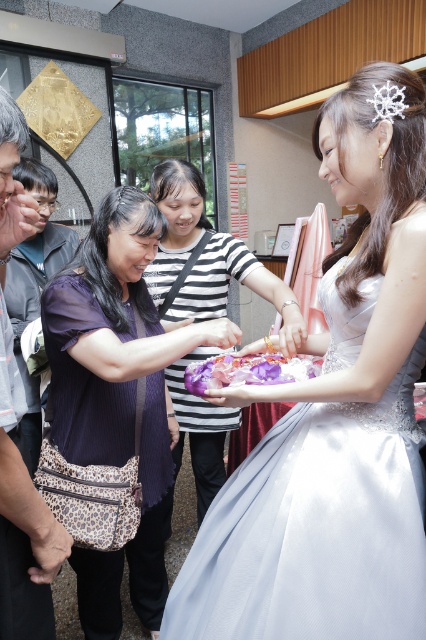
You are a photographer at a wedding venue and need to position a camera to capture both the satin white dress at center and the white lace tiara at upper center. Based on their positions, which object should you focus on first to ensure both are in frame?

The satin white dress at center is to the left of the white lace tiara at upper center, so you should focus on the white lace tiara at upper center first to ensure both are captured in the frame.

Looking at this image, where is the striped fabric dress at center located in the image?

The striped fabric dress at center is located at point 0.405 on the horizontal axis and 0.481 on the vertical axis.

You are a photographer at a wedding venue and need to position a camera to capture both the satin white dress at center and the white lace tiara at upper center. Based on their positions, which object should you focus on first to ensure both are in frame?

The satin white dress at center is located below the white lace tiara at upper center, so you should focus on the white lace tiara at upper center first to ensure both are in frame.